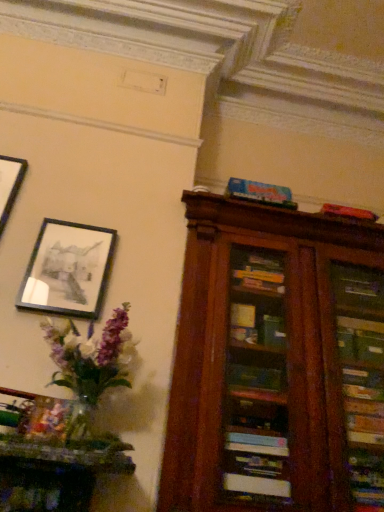
Question: In the image, is translucent glass vase at left positioned in front of or behind matte black picture frame at upper left?

Choices:
 (A) behind
 (B) front

Answer: (B)

Question: From the image's perspective, is translucent glass vase at left above or below matte black picture frame at upper left?

Choices:
 (A) below
 (B) above

Answer: (A)

Question: Which object is the farthest from the matte black picture frame at upper left?

Choices:
 (A) translucent glass vase at left
 (B) blue matte board game at upper center

Answer: (B)

Question: Based on their relative distances, which object is nearer to the matte black picture frame at upper left?

Choices:
 (A) blue matte board game at upper center
 (B) translucent glass vase at left

Answer: (B)